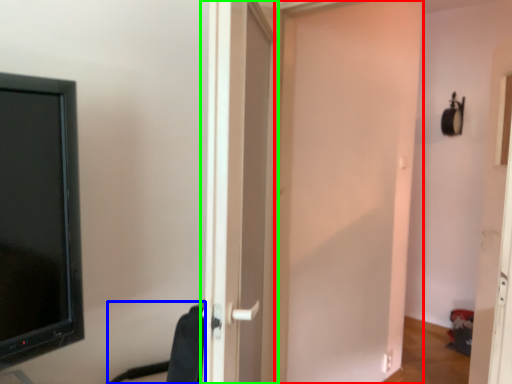
Question: Estimate the real-world distances between objects in this image. Which object is farther from door (highlighted by a red box), swivel chair (highlighted by a blue box) or door (highlighted by a green box)?

Choices:
 (A) swivel chair
 (B) door

Answer: (A)